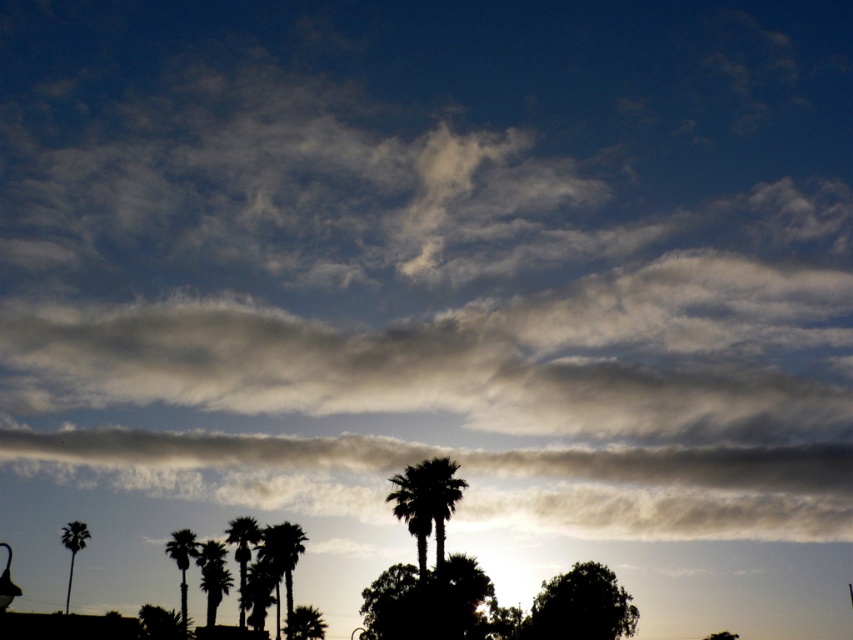
Question: Does silhouette palm tree at lower center have a greater width compared to silhouette palm tree at lower left?

Choices:
 (A) no
 (B) yes

Answer: (A)

Question: Can you confirm if dark green leafy palm tree at center is positioned to the right of green leafy palm tree at center?

Choices:
 (A) no
 (B) yes

Answer: (B)

Question: Does green leafy palm tree at lower center have a lesser width compared to silhouette palm tree at center?

Choices:
 (A) yes
 (B) no

Answer: (A)

Question: Which object is positioned closest to the silhouette palm tree at lower center?

Choices:
 (A) green leafy palm tree at lower center
 (B) silhouette palm tree at center

Answer: (B)

Question: Among these objects, which one is farthest from the camera?

Choices:
 (A) green leafy palm tree at center
 (B) dark green leafy tree at center
 (C) silhouette palm tree at left
 (D) green leafy palm tree at lower center

Answer: (C)

Question: Which of the following is the closest to the observer?

Choices:
 (A) (310, 634)
 (B) (189, 540)
 (C) (62, 545)

Answer: (B)